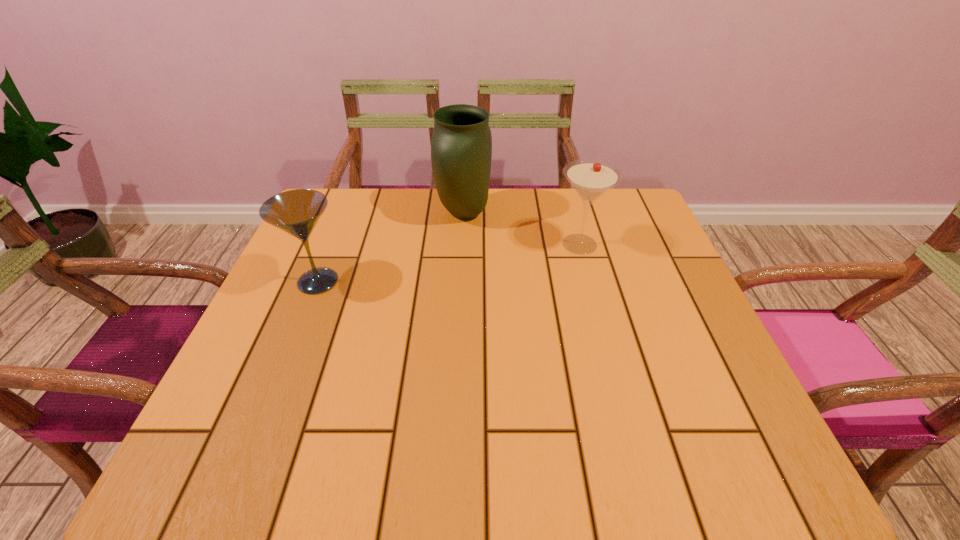
Locate an element on the screen. free space between the leftmost object and the tallest object is located at coordinates (391, 247).

In order to click on free space between the tallest object and the nearest object in this screenshot , I will do click(391, 247).

Image resolution: width=960 pixels, height=540 pixels. Find the location of `empty space between the tallest object and the nearest object`. empty space between the tallest object and the nearest object is located at coordinates (391, 247).

Find the location of a particular element. free point between the right martini and the left martini is located at coordinates pyautogui.click(x=449, y=263).

Where is `vacant space that is in between the second object from right to left and the farther martini`? The image size is (960, 540). vacant space that is in between the second object from right to left and the farther martini is located at coordinates (522, 229).

Locate an element on the screen. free space that is in between the vase and the nearer martini is located at coordinates (391, 247).

What are the coordinates of `empty location between the rightmost object and the second object from right to left` in the screenshot? It's located at (522, 229).

At what (x,y) coordinates should I click in order to perform the action: click on free space between the farther martini and the second object from left to right. Please return your answer as a coordinate pair (x, y). The width and height of the screenshot is (960, 540). Looking at the image, I should click on (522, 229).

The height and width of the screenshot is (540, 960). What are the coordinates of `free space between the left martini and the farther martini` in the screenshot? It's located at (449, 263).

You are a GUI agent. You are given a task and a screenshot of the screen. Output one action in this format:
    pyautogui.click(x=<x>, y=<y>)
    Task: Click on the unoccupied position between the second object from left to right and the leftmost object
    The width and height of the screenshot is (960, 540).
    Given the screenshot: What is the action you would take?
    pyautogui.click(x=391, y=247)